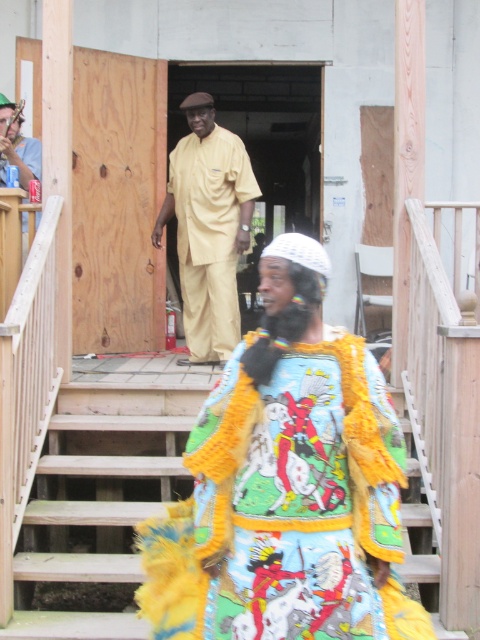
From the picture: Who is shorter, multicolored fabric costume at center or beige matte uniform at center?

multicolored fabric costume at center is shorter.

Does multicolored fabric costume at center have a greater height compared to beige matte uniform at center?

No.

Locate an element on the screen. Image resolution: width=480 pixels, height=640 pixels. multicolored fabric costume at center is located at coordinates (287, 486).

At what (x,y) coordinates should I click in order to perform the action: click on multicolored fabric costume at center. Please return your answer as a coordinate pair (x, y). The image size is (480, 640). Looking at the image, I should click on (287, 486).

Between point (382, 536) and point (113, 465), which one is positioned behind?

Point (113, 465)

Can you confirm if multicolored fabric costume at center is shorter than wooden stairs at lower center?

Incorrect, multicolored fabric costume at center's height does not fall short of wooden stairs at lower center's.

Between point (231, 497) and point (131, 502), which one is positioned behind?

Positioned behind is point (131, 502).

Find the location of a particular element. multicolored fabric costume at center is located at coordinates (287, 486).

Can you confirm if wooden stairs at lower center is positioned above beige matte uniform at center?

Incorrect, wooden stairs at lower center is not positioned above beige matte uniform at center.

Is point (88, 573) less distant than point (208, 340)?

Yes, it is.

Image resolution: width=480 pixels, height=640 pixels. I want to click on wooden stairs at lower center, so click(101, 488).